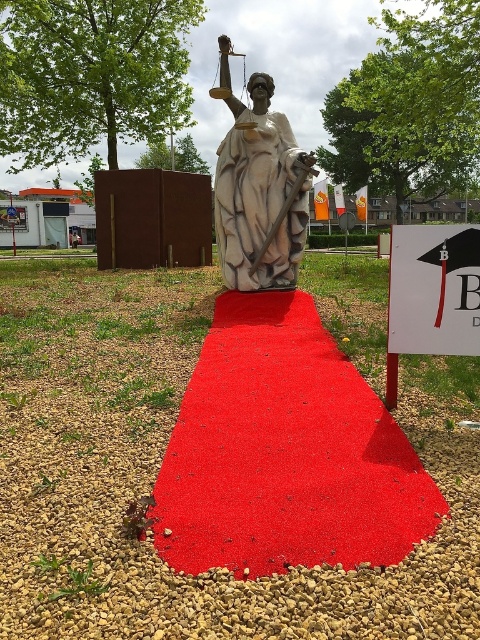
Is red carpet at center shorter than white marble statue at center?

Yes, red carpet at center is shorter than white marble statue at center.

Which of these two, red carpet at center or white marble statue at center, stands shorter?

red carpet at center is shorter.

The height and width of the screenshot is (640, 480). What are the coordinates of `red carpet at center` in the screenshot? It's located at (285, 452).

Consider the image. Is red carpet at center shorter than white paper sign at center?

In fact, red carpet at center may be taller than white paper sign at center.

Which is above, red carpet at center or white paper sign at center?

Positioned higher is white paper sign at center.

Find the location of a particular element. The height and width of the screenshot is (640, 480). red carpet at center is located at coordinates (285, 452).

Who is shorter, white marble statue at center or white paper sign at center?

With less height is white paper sign at center.

Is point (255, 276) positioned in front of point (412, 241)?

No, (255, 276) is further to viewer.

Locate an element on the screen. The image size is (480, 640). white marble statue at center is located at coordinates (259, 188).